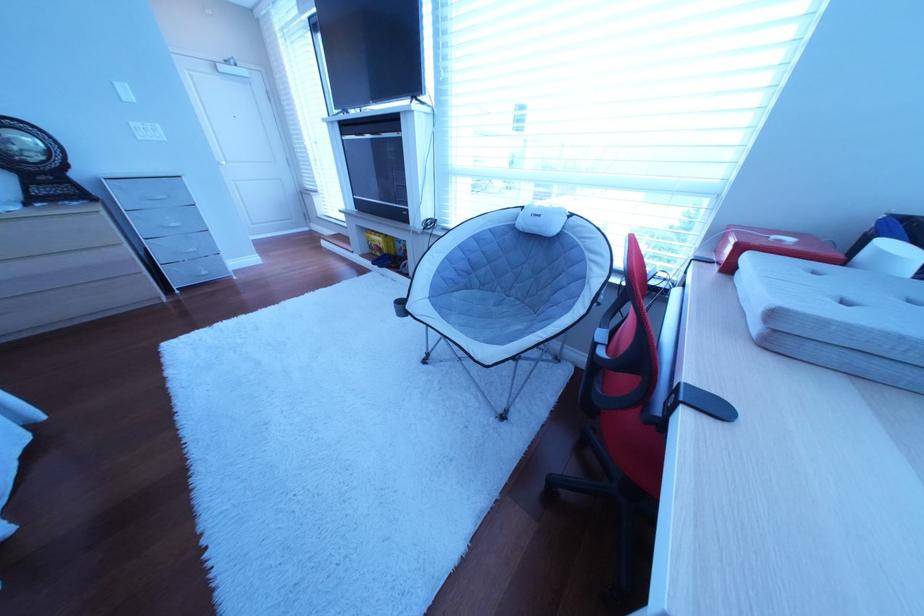
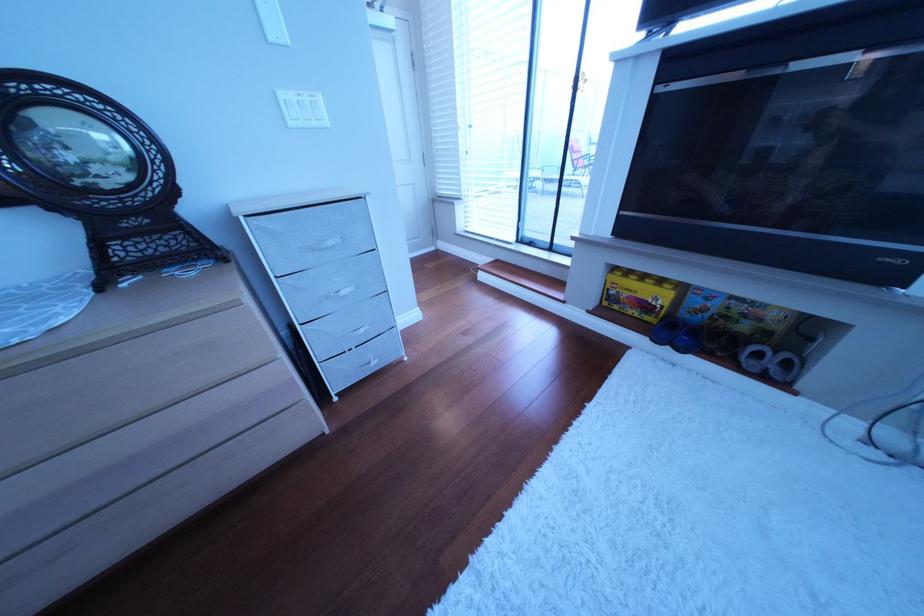
In the second image, find the point that corresponds to pixel 155 140 in the first image.

(307, 126)